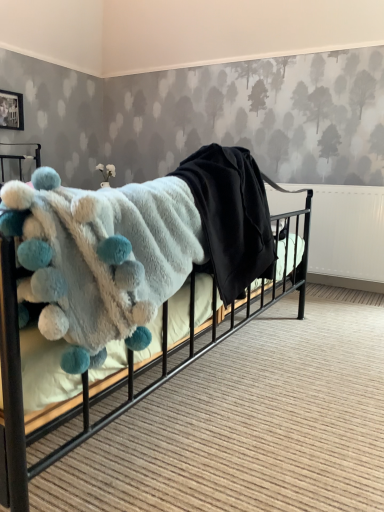
Measure the distance between fluffy fleece blanket at center and camera.

fluffy fleece blanket at center and camera are 26.98 inches apart.

Image resolution: width=384 pixels, height=512 pixels. Find the location of `fluffy fleece blanket at center`. fluffy fleece blanket at center is located at coordinates (129, 271).

Describe the element at coordinates (129, 271) in the screenshot. I see `fluffy fleece blanket at center` at that location.

Where is `fluffy fleece blanket at center`? Image resolution: width=384 pixels, height=512 pixels. fluffy fleece blanket at center is located at coordinates (129, 271).